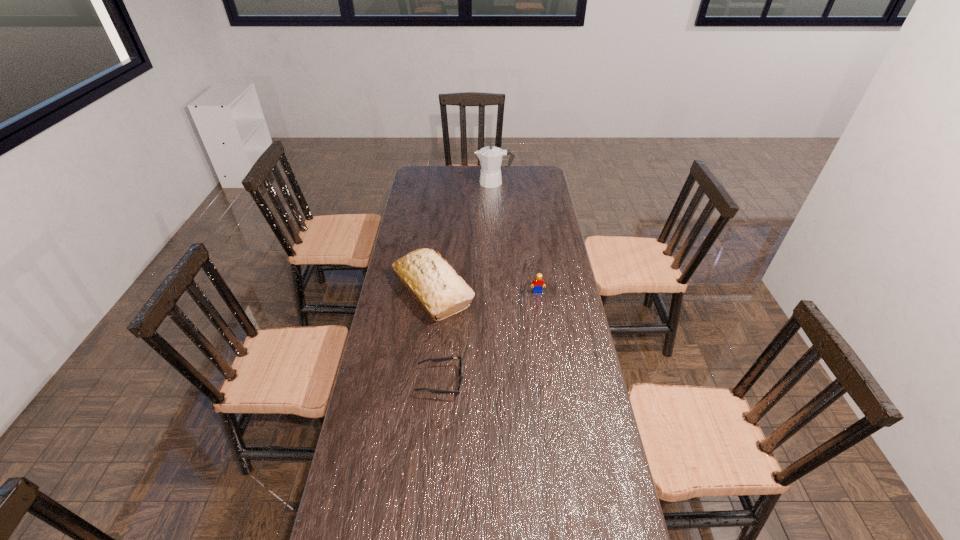
Where is `object that is the third closest to the bread`? object that is the third closest to the bread is located at coordinates (490, 157).

At what (x,y) coordinates should I click in order to perform the action: click on the closest object relative to the coffeepot. Please return your answer as a coordinate pair (x, y). Looking at the image, I should click on (433, 282).

Identify the location of vacant area that satisfies the following two spatial constraints: 1. on the front-facing side of the rightmost object; 2. on the front-facing side of the shortest object. (550, 381).

Image resolution: width=960 pixels, height=540 pixels. I want to click on vacant space that satisfies the following two spatial constraints: 1. on the front-facing side of the second shortest object; 2. on the front-facing side of the sunglasses, so click(550, 381).

I want to click on free region that satisfies the following two spatial constraints: 1. on the front-facing side of the third tallest object; 2. on the front-facing side of the nearest object, so click(550, 381).